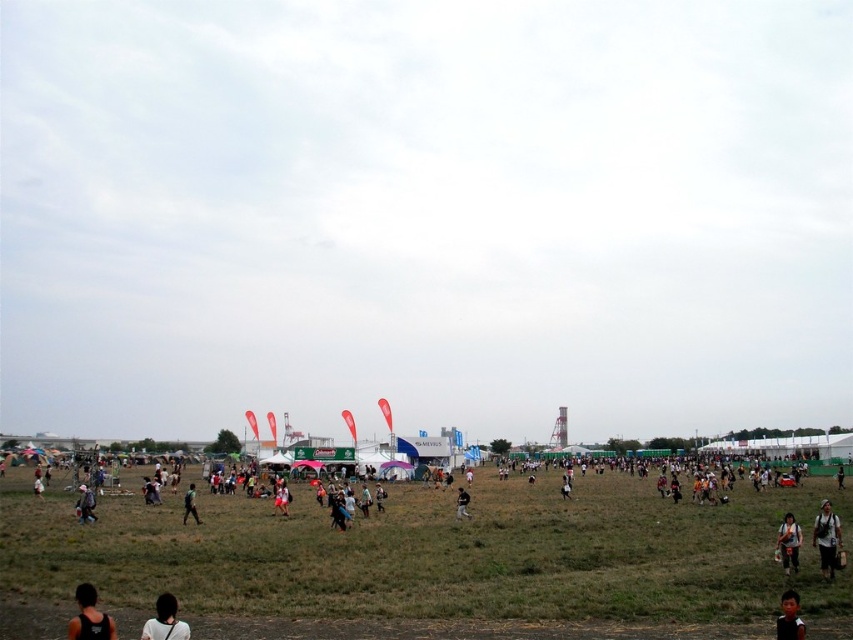
Question: Which of the following is the closest to the observer?

Choices:
 (A) (790, 545)
 (B) (819, 524)

Answer: (A)

Question: Which point is farther from the camera taking this photo?

Choices:
 (A) (457, 502)
 (B) (791, 628)
 (C) (154, 636)
 (D) (86, 589)

Answer: (A)

Question: Can you confirm if black fabric backpack at lower right is thinner than orange fabric bag at lower right?

Choices:
 (A) yes
 (B) no

Answer: (B)

Question: Which object is farther from the camera taking this photo?

Choices:
 (A) light brown fabric pants at lower left
 (B) green matte shirt at center
 (C) green grassy field at lower center

Answer: (A)

Question: Does orange fabric bag at lower right have a lesser width compared to green matte shirt at center?

Choices:
 (A) yes
 (B) no

Answer: (A)

Question: Is orange fabric bag at lower right positioned behind light brown fabric pants at lower left?

Choices:
 (A) yes
 (B) no

Answer: (B)